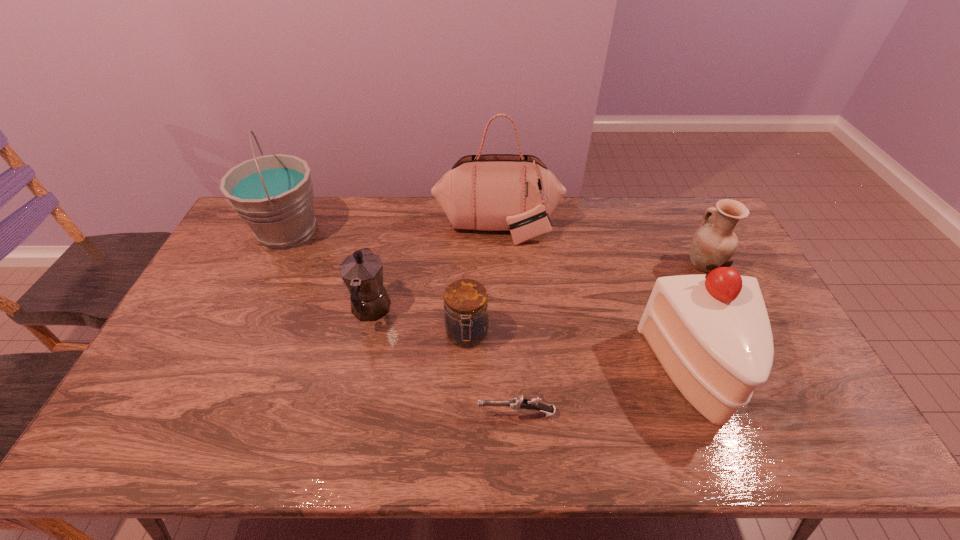
Find the location of `vacant region that satisfies the following two spatial constraints: 1. on the side of the handbag with the attached pouch; 2. on the right side of the pottery`. vacant region that satisfies the following two spatial constraints: 1. on the side of the handbag with the attached pouch; 2. on the right side of the pottery is located at coordinates (499, 265).